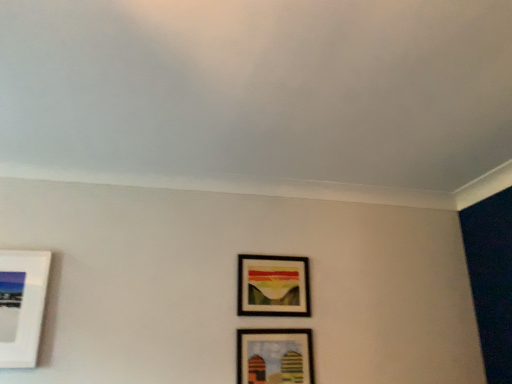
Question: Does wooden framed artwork at center, positioned as the first picture frame in top-to-bottom order, have a greater width compared to wooden framed picture at lower center, positioned as the 1th picture frame in bottom-to-top order?

Choices:
 (A) no
 (B) yes

Answer: (B)

Question: Considering the relative sizes of wooden framed artwork at center, the 2th picture frame in the bottom-to-top sequence, and wooden framed picture at lower center, positioned as the 1th picture frame in bottom-to-top order, in the image provided, is wooden framed artwork at center, the 2th picture frame in the bottom-to-top sequence, bigger than wooden framed picture at lower center, positioned as the 1th picture frame in bottom-to-top order,?

Choices:
 (A) yes
 (B) no

Answer: (A)

Question: Is wooden framed artwork at center, positioned as the first picture frame in top-to-bottom order, positioned with its back to wooden framed picture at lower center, which appears as the second picture frame when viewed from the top?

Choices:
 (A) yes
 (B) no

Answer: (B)

Question: Does wooden framed artwork at center, positioned as the first picture frame in top-to-bottom order, have a lesser height compared to wooden framed picture at lower center, positioned as the 1th picture frame in bottom-to-top order?

Choices:
 (A) no
 (B) yes

Answer: (A)

Question: From a real-world perspective, is wooden framed artwork at center, positioned as the first picture frame in top-to-bottom order, under wooden framed picture at lower center, positioned as the 1th picture frame in bottom-to-top order?

Choices:
 (A) no
 (B) yes

Answer: (A)

Question: Is wooden framed artwork at center, positioned as the first picture frame in top-to-bottom order, placed right next to wooden framed picture at lower center, positioned as the 1th picture frame in bottom-to-top order?

Choices:
 (A) yes
 (B) no

Answer: (B)

Question: Would you say wooden framed artwork at center, the 2th picture frame in the bottom-to-top sequence, is part of wooden framed picture at lower center, which appears as the second picture frame when viewed from the top,'s contents?

Choices:
 (A) no
 (B) yes

Answer: (A)

Question: Considering the relative sizes of wooden framed picture at lower center, positioned as the 1th picture frame in bottom-to-top order, and wooden framed artwork at center, the 2th picture frame in the bottom-to-top sequence, in the image provided, is wooden framed picture at lower center, positioned as the 1th picture frame in bottom-to-top order, smaller than wooden framed artwork at center, the 2th picture frame in the bottom-to-top sequence,?

Choices:
 (A) no
 (B) yes

Answer: (B)

Question: From the image's perspective, is wooden framed picture at lower center, positioned as the 1th picture frame in bottom-to-top order, located above wooden framed artwork at center, positioned as the first picture frame in top-to-bottom order?

Choices:
 (A) no
 (B) yes

Answer: (A)

Question: Does wooden framed picture at lower center, positioned as the 1th picture frame in bottom-to-top order, appear on the right side of wooden framed artwork at center, the 2th picture frame in the bottom-to-top sequence?

Choices:
 (A) no
 (B) yes

Answer: (B)

Question: Is wooden framed picture at lower center, positioned as the 1th picture frame in bottom-to-top order, at the left side of wooden framed artwork at center, positioned as the first picture frame in top-to-bottom order?

Choices:
 (A) no
 (B) yes

Answer: (A)

Question: Are wooden framed picture at lower center, which appears as the second picture frame when viewed from the top, and wooden framed artwork at center, the 2th picture frame in the bottom-to-top sequence, located far from each other?

Choices:
 (A) no
 (B) yes

Answer: (A)

Question: Considering the positions of wooden framed artwork at center, the 2th picture frame in the bottom-to-top sequence, and wooden framed picture at lower center, which appears as the second picture frame when viewed from the top, in the image, is wooden framed artwork at center, the 2th picture frame in the bottom-to-top sequence, bigger or smaller than wooden framed picture at lower center, which appears as the second picture frame when viewed from the top,?

Choices:
 (A) small
 (B) big

Answer: (B)